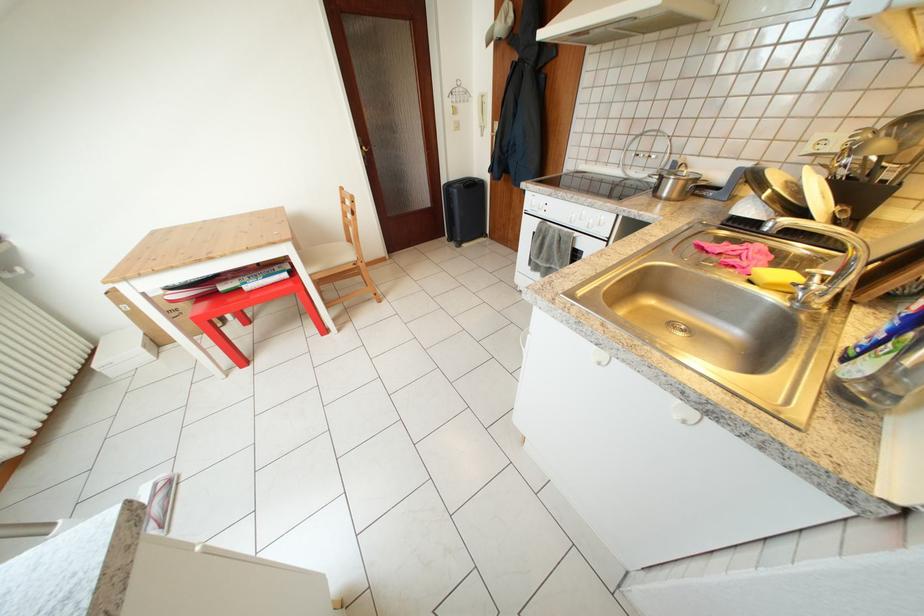
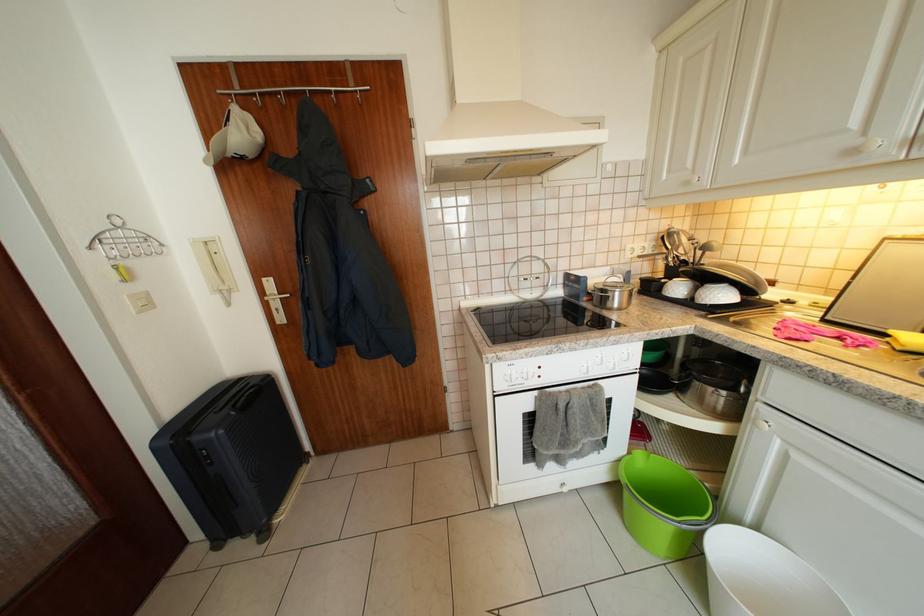
Find the pixel in the second image that matches the point at 465,123 in the first image.

(144, 293)